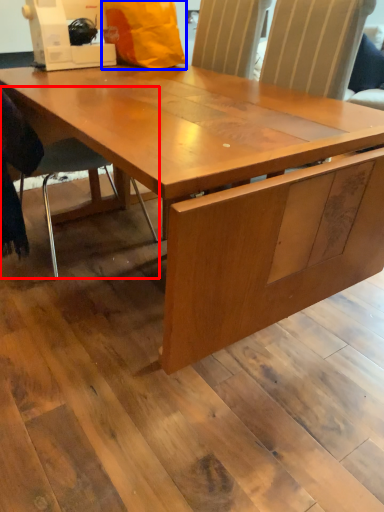
Question: Which of the following is the farthest to the observer, chair (highlighted by a red box) or paper bag (highlighted by a blue box)?

Choices:
 (A) chair
 (B) paper bag

Answer: (B)